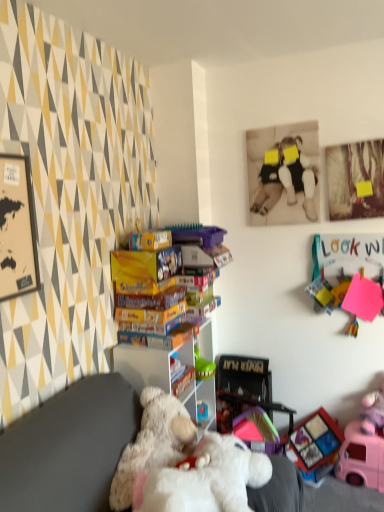
Question: Is matte plastic toy at lower right, positioned as the third toy in top-to-bottom order, spatially inside pink fabric doll at lower right, arranged as the second toy when viewed from the top, or outside of it?

Choices:
 (A) outside
 (B) inside

Answer: (A)

Question: Considering the positions of matte plastic toy at lower right, positioned as the third toy in top-to-bottom order, and pink fabric doll at lower right, arranged as the second toy when viewed from the top, in the image, is matte plastic toy at lower right, positioned as the third toy in top-to-bottom order, taller or shorter than pink fabric doll at lower right, arranged as the second toy when viewed from the top,?

Choices:
 (A) short
 (B) tall

Answer: (B)

Question: Estimate the real-world distances between objects in this image. Which object is farther from the matte plastic toy at lower right, which ranks as the second toy in bottom-to-top order?

Choices:
 (A) pink felt sign at upper right, which ranks as the 1th toy in top-to-bottom order
 (B) sepia-toned photograph at upper center
 (C) white plastic shelf at center
 (D) pink plastic toy car at lower right, the first toy ordered from the bottom
 (E) white plush bear at center

Answer: (B)

Question: Which is nearer to the white plastic shelf at center?

Choices:
 (A) pink fabric doll at lower right, arranged as the second toy when viewed from the top
 (B) pink felt sign at upper right, which ranks as the 1th toy in top-to-bottom order
 (C) pink plastic toy car at lower right, the first toy ordered from the bottom
 (D) sepia-toned photograph at upper center
 (E) matte plastic toy at lower right, positioned as the third toy in top-to-bottom order

Answer: (E)